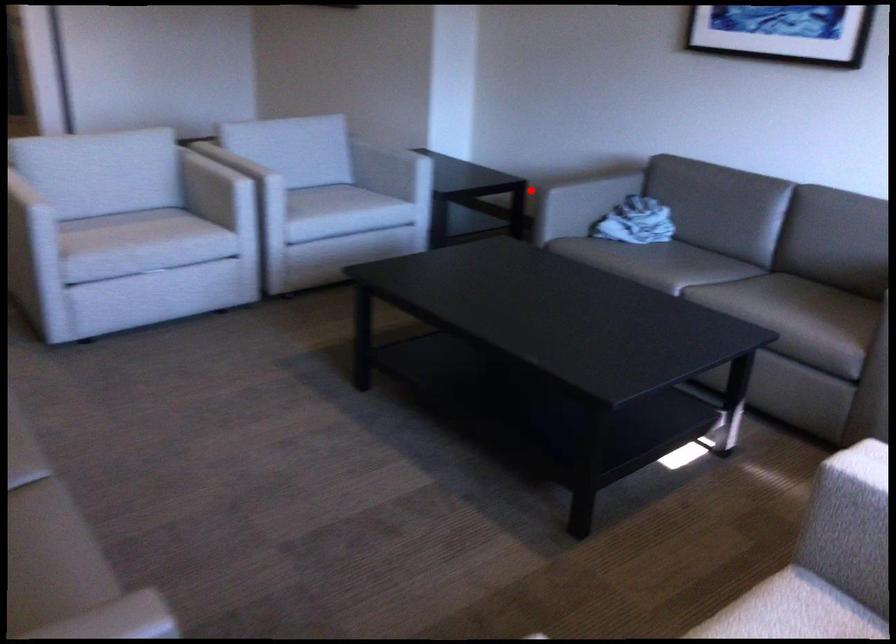
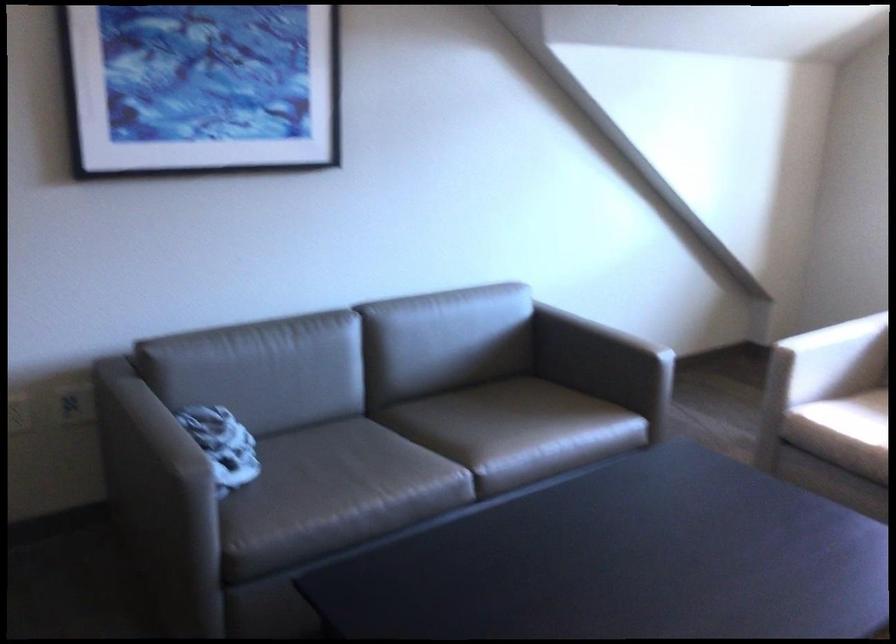
The point at the highlighted location is marked in the first image. Where is the corresponding point in the second image?

(158, 491)